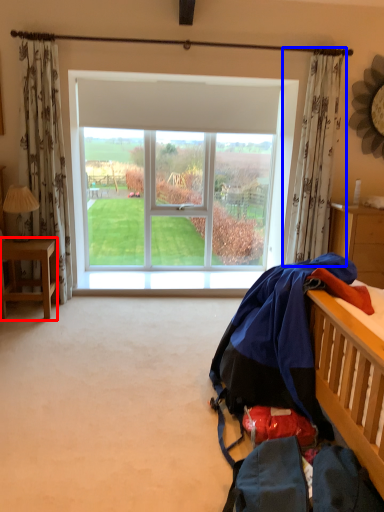
Question: Which of the following is the closest to the observer, desk (highlighted by a red box) or curtain (highlighted by a blue box)?

Choices:
 (A) desk
 (B) curtain

Answer: (A)